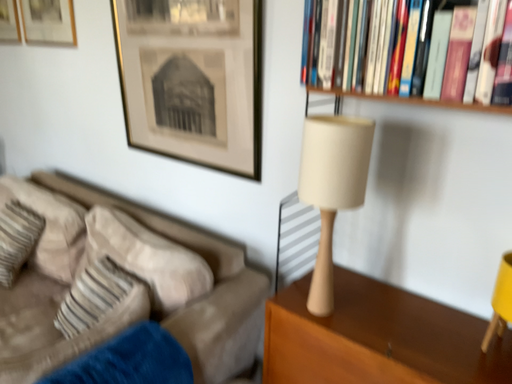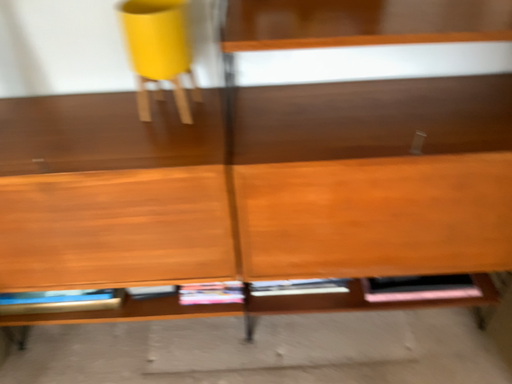
Question: How did the camera likely rotate when shooting the video?

Choices:
 (A) rotated left
 (B) rotated right

Answer: (B)